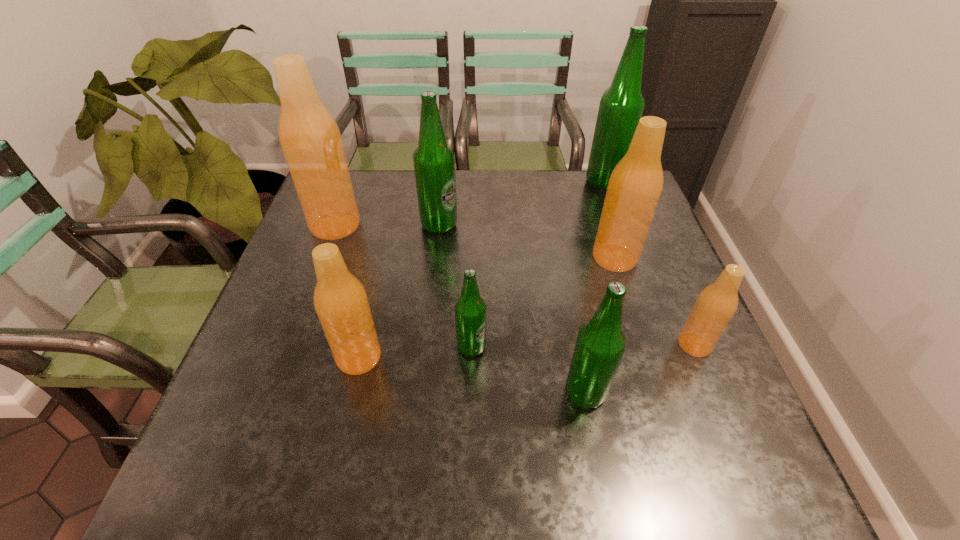
The width and height of the screenshot is (960, 540). Identify the location of the third biggest green beer bottle. (600, 344).

You are a GUI agent. You are given a task and a screenshot of the screen. Output one action in this format:
    pyautogui.click(x=<x>, y=<y>)
    Task: Click on the nearest green beer bottle
    The image size is (960, 540).
    Given the screenshot: What is the action you would take?
    pyautogui.click(x=600, y=344)

Identify the location of the fifth beer bottle from right to left. (470, 310).

Identify the location of the second green beer bottle from left to right. The height and width of the screenshot is (540, 960). (470, 310).

At what (x,y) coordinates should I click in order to perform the action: click on the rightmost tan beer bottle. Please return your answer as a coordinate pair (x, y). Looking at the image, I should click on (715, 306).

Identify the location of vacant position located 0.100m on the label of the rightmost green beer bottle. (554, 181).

Identify the location of free spot located on the label of the rightmost green beer bottle. This screenshot has width=960, height=540. (469, 181).

In order to click on free space located 0.190m on the label of the rightmost green beer bottle in this screenshot , I will do `click(525, 181)`.

Locate an element on the screen. Image resolution: width=960 pixels, height=540 pixels. free space located 0.140m on the front of the leftmost object is located at coordinates (316, 278).

Locate an element on the screen. vacant space positioned 0.270m on the label of the leftmost green beer bottle is located at coordinates (553, 225).